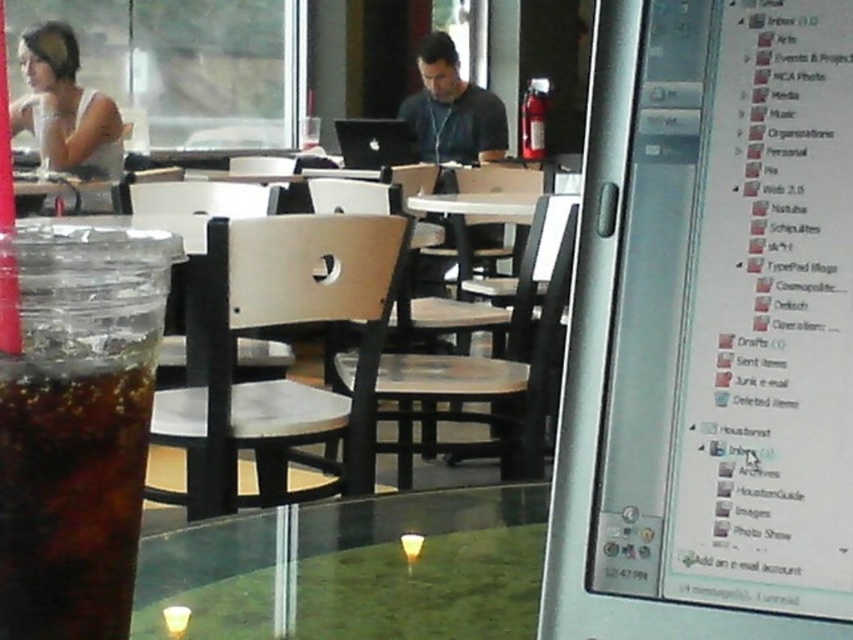
Is dark brown liquid at lower left taller than matte black shirt at center?

In fact, dark brown liquid at lower left may be shorter than matte black shirt at center.

Between dark brown liquid at lower left and matte black shirt at center, which one has less height?

dark brown liquid at lower left is shorter.

Who is more forward, (x=50, y=401) or (x=457, y=109)?

Positioned in front is point (x=50, y=401).

This screenshot has height=640, width=853. Identify the location of dark brown liquid at lower left. (70, 493).

Measure the distance from transparent glass table at center to dark brown liquid at lower left.

transparent glass table at center and dark brown liquid at lower left are 26.71 centimeters apart.

Is transparent glass table at center wider than dark brown liquid at lower left?

Correct, the width of transparent glass table at center exceeds that of dark brown liquid at lower left.

Is point (397, 627) more distant than point (51, 444)?

Yes, point (397, 627) is behind point (51, 444).

You are a GUI agent. You are given a task and a screenshot of the screen. Output one action in this format:
    pyautogui.click(x=<x>, y=<y>)
    Task: Click on the transparent glass table at center
    This screenshot has height=640, width=853.
    Given the screenshot: What is the action you would take?
    pyautogui.click(x=355, y=570)

Is silver metallic monitor at center right taller than matte white shirt at upper left?

Incorrect, silver metallic monitor at center right's height is not larger of matte white shirt at upper left's.

Who is more forward, (589, 349) or (54, 164)?

Point (589, 349) is more forward.

Which is behind, point (589, 408) or point (54, 32)?

The point (54, 32) is more distant.

Find the location of `silver metallic monitor at center right`. silver metallic monitor at center right is located at coordinates (604, 392).